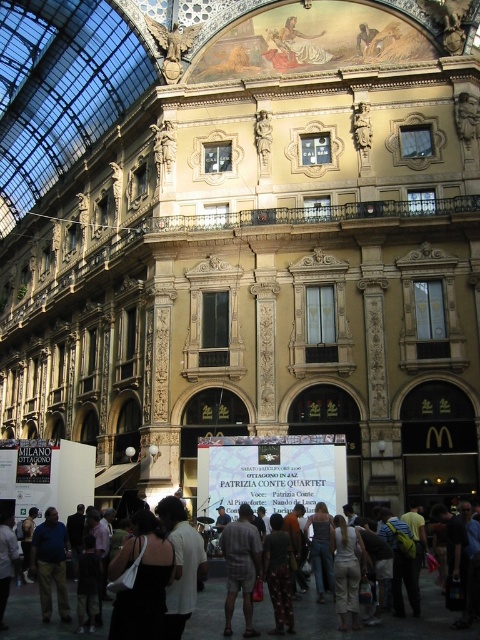
The image size is (480, 640). What do you see at coordinates (142, 580) in the screenshot?
I see `black fabric dress at lower center` at bounding box center [142, 580].

Is black fabric dress at lower center smaller than dark blue jeans at lower left?

Yes.

Which is behind, point (153, 577) or point (57, 552)?

Point (57, 552)

You are a GUI agent. You are given a task and a screenshot of the screen. Output one action in this format:
    pyautogui.click(x=<x>, y=<y>)
    Task: Click on the black fabric dress at lower center
    The width and height of the screenshot is (480, 640).
    Given the screenshot: What is the action you would take?
    pyautogui.click(x=142, y=580)

Between point (479, 632) and point (168, 577), which one is positioned behind?

The point (479, 632) is more distant.

How distant is dark gray pants at center from black fabric dress at lower center?

dark gray pants at center and black fabric dress at lower center are 8.92 meters apart from each other.

Which is in front, point (44, 628) or point (132, 593)?

Point (132, 593)

Locate an element on the screen. The image size is (480, 640). dark gray pants at center is located at coordinates (383, 620).

Based on the photo, does dark blue jeans at lower left lie behind printed cotton dress at center?

No, dark blue jeans at lower left is in front of printed cotton dress at center.

Does dark blue jeans at lower left appear on the right side of printed cotton dress at center?

No, dark blue jeans at lower left is not to the right of printed cotton dress at center.

What do you see at coordinates (50, 564) in the screenshot? This screenshot has width=480, height=640. I see `dark blue jeans at lower left` at bounding box center [50, 564].

Identify the location of dark blue jeans at lower left. The image size is (480, 640). (50, 564).